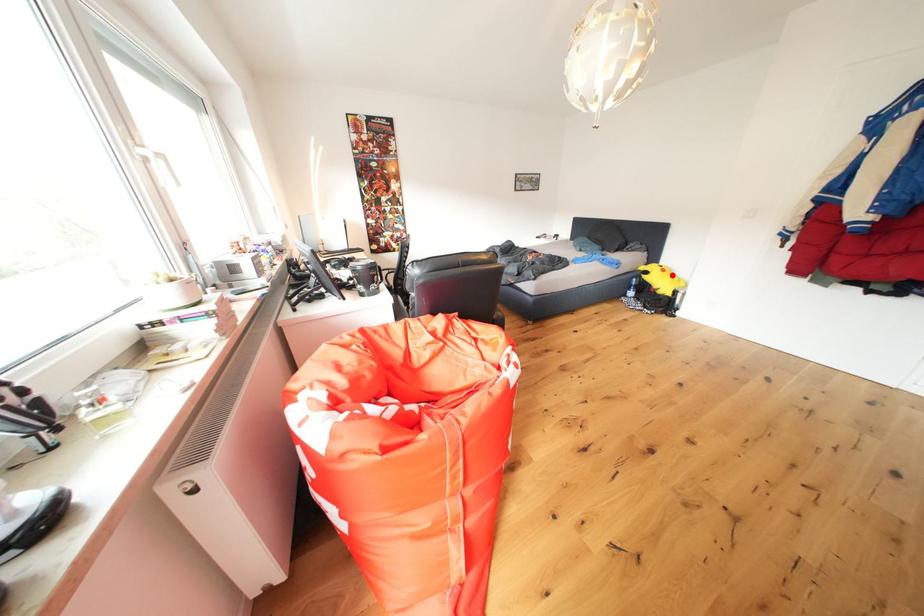
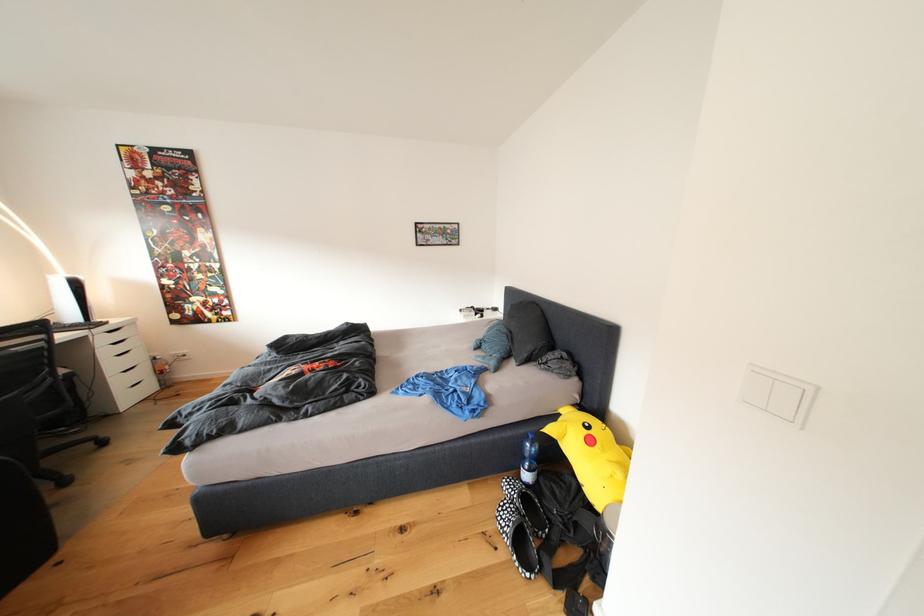
Question: I am providing you with two images of the same scene from different viewpoints. In image1, a red point is highlighted. Considering the same 3D point in image2, which of the following is correct?

Choices:
 (A) It is closer
 (B) It is farther

Answer: (B)